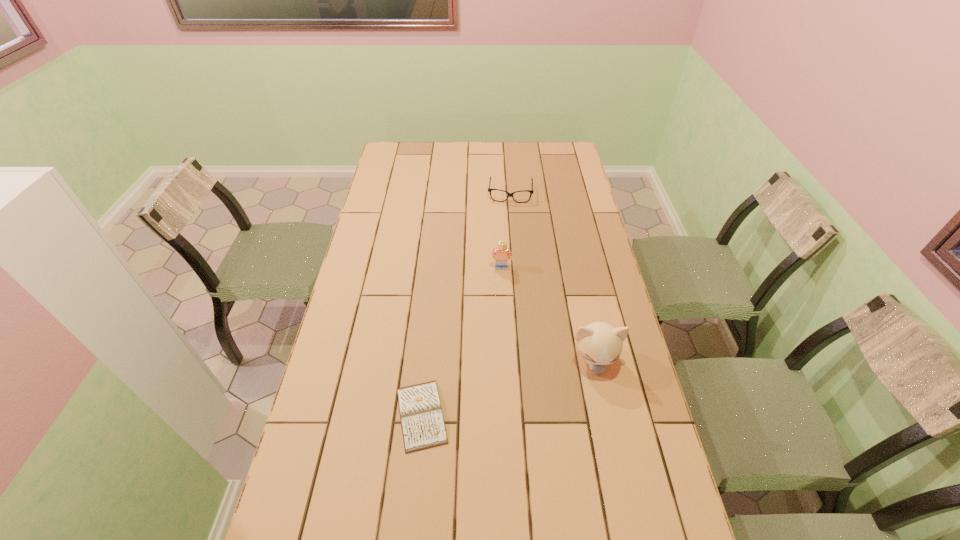
Locate an element on the screen. This screenshot has height=540, width=960. vacant region located on the front-facing side of the second tallest object is located at coordinates (501, 335).

This screenshot has height=540, width=960. What are the coordinates of `free region located on the front-facing side of the second tallest object` in the screenshot? It's located at (501, 288).

Locate an element on the screen. vacant space located on the front-facing side of the second tallest object is located at coordinates (501, 346).

I want to click on vacant point located 0.070m on the front-facing side of the farthest object, so click(x=509, y=215).

The height and width of the screenshot is (540, 960). I want to click on free space located on the front-facing side of the farthest object, so click(x=508, y=229).

Identify the location of vacant region located 0.330m on the front-facing side of the farthest object. (507, 259).

Image resolution: width=960 pixels, height=540 pixels. I want to click on object that is at the right edge, so click(x=599, y=343).

Locate an element on the screen. This screenshot has width=960, height=540. vacant space at the far edge is located at coordinates (424, 156).

In the image, there is a desktop. Where is `vacant space at the left edge`? vacant space at the left edge is located at coordinates (407, 209).

Where is `free space at the right edge of the desktop`? The height and width of the screenshot is (540, 960). free space at the right edge of the desktop is located at coordinates (605, 451).